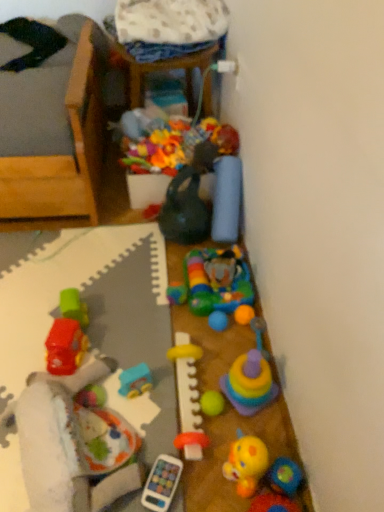
Where is `free spot in front of rubberized plastic stacking cups at center-right, the ninth toy from the left`? free spot in front of rubberized plastic stacking cups at center-right, the ninth toy from the left is located at coordinates pyautogui.click(x=259, y=440).